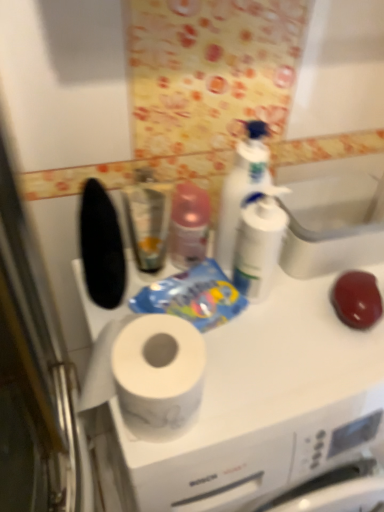
At what (x,y) coordinates should I click in order to perform the action: click on white plastic pump bottle at center. Please return your answer as a coordinate pair (x, y). Looking at the image, I should click on [x=259, y=245].

What do you see at coordinates (148, 217) in the screenshot? I see `metallic silver mouthwash at center` at bounding box center [148, 217].

The height and width of the screenshot is (512, 384). What do you see at coordinates (241, 189) in the screenshot?
I see `white glossy bottle at upper center` at bounding box center [241, 189].

This screenshot has height=512, width=384. Identify the location of white plastic pump bottle at center. (259, 245).

Is white glossy bottle at upper center completely or partially outside of white plastic pump bottle at center?

Yes, white glossy bottle at upper center is outside of white plastic pump bottle at center.

The height and width of the screenshot is (512, 384). What are the coordinates of `cleaning product that is above the white plastic pump bottle at center (from the image's perspective)` in the screenshot? It's located at (241, 189).

Can you see white glossy bottle at upper center touching white plastic pump bottle at center?

Yes.

Is white glossy bottle at upper center positioned with its back to white plastic pump bottle at center?

That's right, white glossy bottle at upper center is facing away from white plastic pump bottle at center.

Which of these two, white glossy bottle at upper center or white matte countertop at center, is smaller?

Smaller between the two is white glossy bottle at upper center.

Which object is closer to the camera, white glossy bottle at upper center or white matte countertop at center?

white matte countertop at center is closer to the camera.

Considering the sizes of objects white glossy bottle at upper center and white matte countertop at center in the image provided, who is wider, white glossy bottle at upper center or white matte countertop at center?

white matte countertop at center.

You are a GUI agent. You are given a task and a screenshot of the screen. Output one action in this format:
    pyautogui.click(x=<x>, y=<y>)
    Task: Click on the cleaning product that is above the white matte countertop at center (from the image's perspective)
    
    Given the screenshot: What is the action you would take?
    pyautogui.click(x=241, y=189)

From the image's perspective, who appears lower, white matte countertop at center or white plastic pump bottle at center?

white matte countertop at center is shown below in the image.

Is white matte countertop at center bigger than white plastic pump bottle at center?

Indeed, white matte countertop at center has a larger size compared to white plastic pump bottle at center.

How many degrees apart are the facing directions of white matte countertop at center and white plastic pump bottle at center?

There is a 0.588-degree angle between the facing directions of white matte countertop at center and white plastic pump bottle at center.

Looking at this image, considering the positions of objects white matte countertop at center and white plastic pump bottle at center in the image provided, who is more to the right, white matte countertop at center or white plastic pump bottle at center?

From the viewer's perspective, white matte countertop at center appears more on the right side.

Does white matte countertop at center have a greater height compared to white glossy bottle at upper center?

Indeed, white matte countertop at center has a greater height compared to white glossy bottle at upper center.

Is white matte countertop at center positioned beyond the bounds of white glossy bottle at upper center?

Absolutely, white matte countertop at center is external to white glossy bottle at upper center.

Is white matte countertop at center beside white glossy bottle at upper center?

No, white matte countertop at center is not next to white glossy bottle at upper center.

Is white matte countertop at center bigger or smaller than white glossy bottle at upper center?

white matte countertop at center is bigger than white glossy bottle at upper center.

Is white plastic pump bottle at center surrounded by white glossy sink at upper center?

Actually, white plastic pump bottle at center is outside white glossy sink at upper center.

Is white glossy sink at upper center oriented away from white plastic pump bottle at center?

No, white glossy sink at upper center is not facing the opposite direction of white plastic pump bottle at center.

Is white glossy sink at upper center touching white plastic pump bottle at center?

No, white glossy sink at upper center is not with white plastic pump bottle at center.

Which object is thinner, white glossy sink at upper center or white plastic pump bottle at center?

With smaller width is white plastic pump bottle at center.

Does white plastic pump bottle at center touch white glossy sink at upper center?

There is a gap between white plastic pump bottle at center and white glossy sink at upper center.

From the image's perspective, is white plastic pump bottle at center on white glossy sink at upper center?

No, from the image's perspective, white plastic pump bottle at center is not above white glossy sink at upper center.

Can you tell me how much white plastic pump bottle at center and white glossy sink at upper center differ in facing direction?

They differ by 1.73 degrees in their facing directions.

Is white plastic pump bottle at center facing towards white glossy sink at upper center?

No, white plastic pump bottle at center does not turn towards white glossy sink at upper center.

Is white plastic pump bottle at center facing away from metallic silver mouthwash at center?

white plastic pump bottle at center is not turned away from metallic silver mouthwash at center.

How different are the orientations of white plastic pump bottle at center and metallic silver mouthwash at center in degrees?

They differ by 0.00091 degrees in their facing directions.

Considering the points (235, 256) and (152, 180), which point is in front, point (235, 256) or point (152, 180)?

The point (235, 256) is in front.

Considering the sizes of white plastic pump bottle at center and metallic silver mouthwash at center in the image, is white plastic pump bottle at center wider or thinner than metallic silver mouthwash at center?

white plastic pump bottle at center is wider than metallic silver mouthwash at center.

The image size is (384, 512). I want to click on toiletry below the white glossy bottle at upper center (from the image's perspective), so click(259, 245).

You are a GUI agent. You are given a task and a screenshot of the screen. Output one action in this format:
    pyautogui.click(x=<x>, y=<y>)
    Task: Click on the cleaning product that is above the white matte countertop at center (from the image's perspective)
    
    Given the screenshot: What is the action you would take?
    pyautogui.click(x=241, y=189)

When comparing their distances from white glossy sink at upper center, does white plastic pump bottle at center or white matte countertop at center seem closer?

white plastic pump bottle at center is closer to white glossy sink at upper center.

Which object lies further to the anchor point white glossy bottle at upper center, white plastic pump bottle at center or white glossy sink at upper center?

white glossy sink at upper center is positioned further to the anchor white glossy bottle at upper center.

Based on the photo, which object lies nearer to the anchor point metallic silver mouthwash at center, white plastic pump bottle at center or white glossy bottle at upper center?

Based on the image, white glossy bottle at upper center appears to be nearer to metallic silver mouthwash at center.

When comparing their distances from white glossy bottle at upper center, does white matte countertop at center or metallic silver mouthwash at center seem further?

Among the two, white matte countertop at center is located further to white glossy bottle at upper center.

Looking at the image, which one is located closer to white glossy bottle at upper center, white glossy sink at upper center or white matte countertop at center?

Based on the image, white matte countertop at center appears to be nearer to white glossy bottle at upper center.

Based on their spatial positions, is metallic silver mouthwash at center or white glossy sink at upper center closer to white glossy bottle at upper center?

metallic silver mouthwash at center.

When comparing their distances from white matte countertop at center, does metallic silver mouthwash at center or white glossy sink at upper center seem further?

Based on the image, white glossy sink at upper center appears to be further to white matte countertop at center.

From the picture: Considering their positions, is white matte countertop at center positioned further to white plastic pump bottle at center than metallic silver mouthwash at center?

white matte countertop at center is further to white plastic pump bottle at center.

Identify the location of cleaning product between metallic silver mouthwash at center and white plastic pump bottle at center. (241, 189).

The height and width of the screenshot is (512, 384). I want to click on sink between white glossy bottle at upper center and white matte countertop at center vertically, so click(x=333, y=215).

You are a GUI agent. You are given a task and a screenshot of the screen. Output one action in this format:
    pyautogui.click(x=<x>, y=<y>)
    Task: Click on the toiletry between white glossy sink at upper center and white matte countertop at center vertically
    
    Given the screenshot: What is the action you would take?
    pyautogui.click(x=259, y=245)

Find the location of a particular element. Image resolution: width=384 pixels, height=512 pixels. toiletry located between metallic silver mouthwash at center and white glossy sink at upper center in the left-right direction is located at coordinates (259, 245).